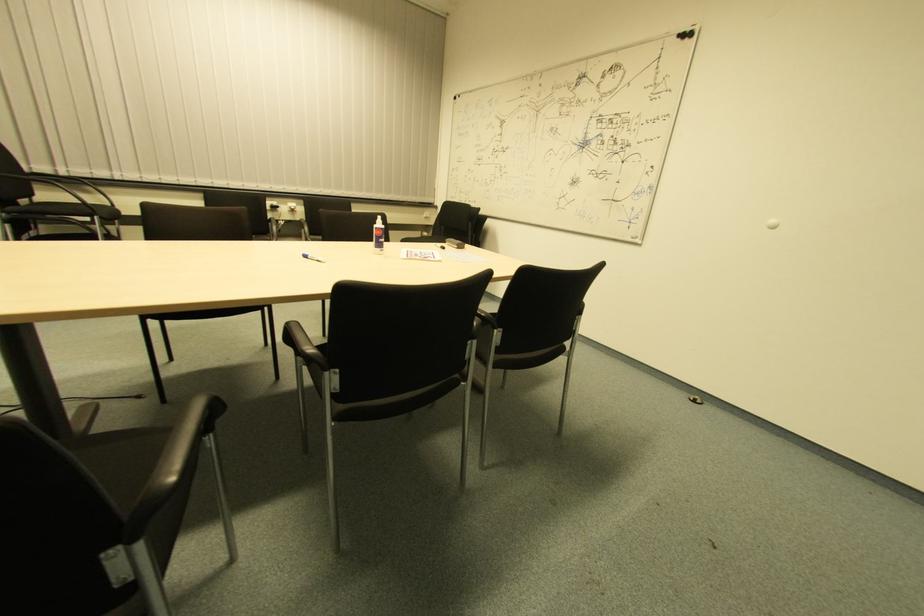
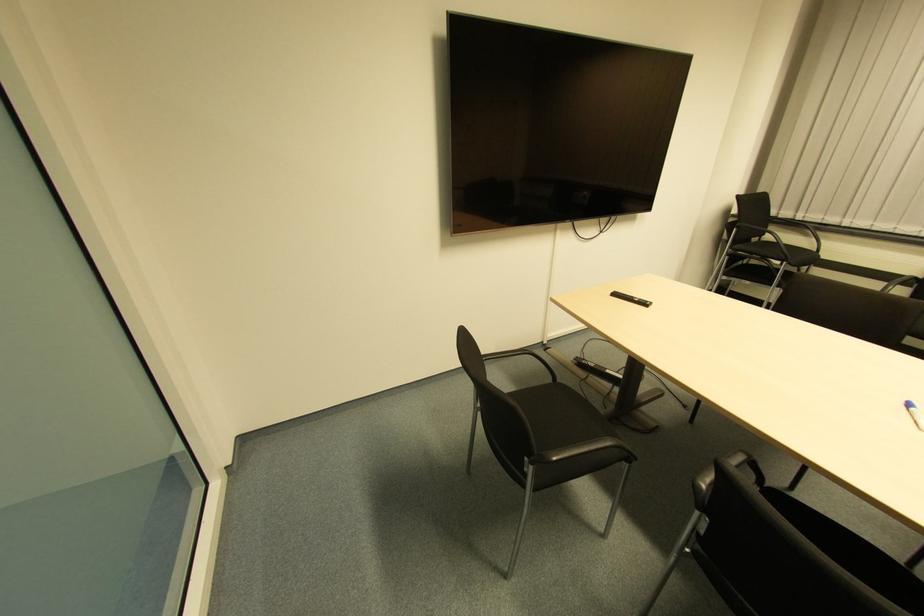
In the second image, find the point that corresponds to pixel 304 260 in the first image.

(907, 408)